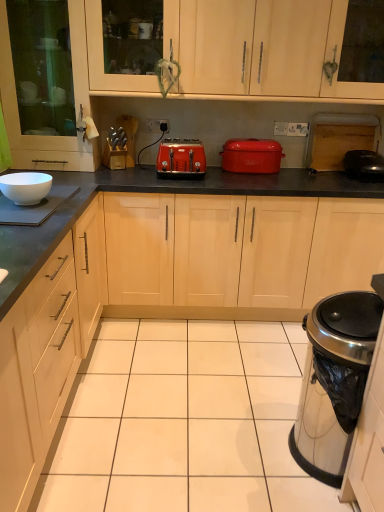
Question: Can you confirm if black glossy pan at right, arranged as the 3th appliance when viewed from the left, is wider than white plastic electric outlet at center?

Choices:
 (A) yes
 (B) no

Answer: (A)

Question: Is black glossy pan at right, arranged as the 1th appliance when viewed from the back, not close to white plastic electric outlet at center?

Choices:
 (A) no
 (B) yes

Answer: (B)

Question: Does black glossy pan at right, arranged as the 3th appliance when viewed from the front, appear on the left side of white plastic electric outlet at center?

Choices:
 (A) no
 (B) yes

Answer: (A)

Question: Does black glossy pan at right, arranged as the 1th appliance when viewed from the back, lie in front of white plastic electric outlet at center?

Choices:
 (A) yes
 (B) no

Answer: (A)

Question: Can you confirm if black glossy pan at right, arranged as the 3th appliance when viewed from the left, is thinner than white plastic electric outlet at center?

Choices:
 (A) no
 (B) yes

Answer: (A)

Question: Is black glossy pan at right, placed as the first appliance when sorted from top to bottom, positioned behind white plastic electric outlet at center?

Choices:
 (A) no
 (B) yes

Answer: (A)

Question: Is black granite countertop at center positioned with its back to black glossy pan at right, arranged as the 3th appliance when viewed from the left?

Choices:
 (A) no
 (B) yes

Answer: (A)

Question: Considering the relative sizes of black granite countertop at center and black glossy pan at right, arranged as the 1th appliance when viewed from the back, in the image provided, is black granite countertop at center thinner than black glossy pan at right, arranged as the 1th appliance when viewed from the back,?

Choices:
 (A) yes
 (B) no

Answer: (B)

Question: Does black granite countertop at center turn towards black glossy pan at right, which is the third appliance in bottom-to-top order?

Choices:
 (A) no
 (B) yes

Answer: (A)

Question: From the image's perspective, is black granite countertop at center on top of black glossy pan at right, placed as the 1th appliance when sorted from right to left?

Choices:
 (A) yes
 (B) no

Answer: (B)

Question: Would you say black granite countertop at center is outside black glossy pan at right, arranged as the 1th appliance when viewed from the back?

Choices:
 (A) yes
 (B) no

Answer: (A)

Question: Is black granite countertop at center at the left side of black glossy pan at right, which is the third appliance in bottom-to-top order?

Choices:
 (A) no
 (B) yes

Answer: (B)

Question: Is satin silver trash can at lower right, the 3th appliance in the top-to-bottom sequence, oriented towards white glossy bowl at left, the 1th appliance from the left?

Choices:
 (A) no
 (B) yes

Answer: (B)